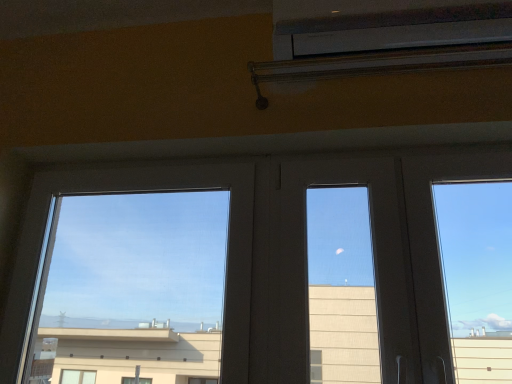
Question: Could you tell me if white plastic air conditioning unit at upper center is facing transparent glass window at left?

Choices:
 (A) no
 (B) yes

Answer: (A)

Question: Is white plastic air conditioning unit at upper center smaller than transparent glass window at left?

Choices:
 (A) yes
 (B) no

Answer: (A)

Question: Does white plastic air conditioning unit at upper center have a greater width compared to transparent glass window at left?

Choices:
 (A) yes
 (B) no

Answer: (A)

Question: Is transparent glass window at left located within white plastic air conditioning unit at upper center?

Choices:
 (A) no
 (B) yes

Answer: (A)

Question: Is white plastic air conditioning unit at upper center far from transparent glass window at left?

Choices:
 (A) no
 (B) yes

Answer: (A)

Question: Does white plastic air conditioning unit at upper center appear on the left side of transparent glass window at left?

Choices:
 (A) yes
 (B) no

Answer: (B)

Question: Is transparent glass window at left placed right next to white plastic air conditioning unit at upper center?

Choices:
 (A) yes
 (B) no

Answer: (B)

Question: Can you confirm if transparent glass window at left is taller than white plastic air conditioning unit at upper center?

Choices:
 (A) yes
 (B) no

Answer: (A)

Question: Would you say white plastic air conditioning unit at upper center is part of transparent glass window at left's contents?

Choices:
 (A) yes
 (B) no

Answer: (B)

Question: Is transparent glass window at left further to the viewer compared to white plastic air conditioning unit at upper center?

Choices:
 (A) no
 (B) yes

Answer: (B)

Question: Considering the relative sizes of transparent glass window at left and white plastic air conditioning unit at upper center in the image provided, is transparent glass window at left wider than white plastic air conditioning unit at upper center?

Choices:
 (A) no
 (B) yes

Answer: (A)

Question: Is transparent glass window at left at the left side of white plastic air conditioning unit at upper center?

Choices:
 (A) yes
 (B) no

Answer: (A)

Question: Considering the relative positions of white plastic air conditioning unit at upper center and transparent glass window at left in the image provided, is white plastic air conditioning unit at upper center to the left or to the right of transparent glass window at left?

Choices:
 (A) left
 (B) right

Answer: (B)